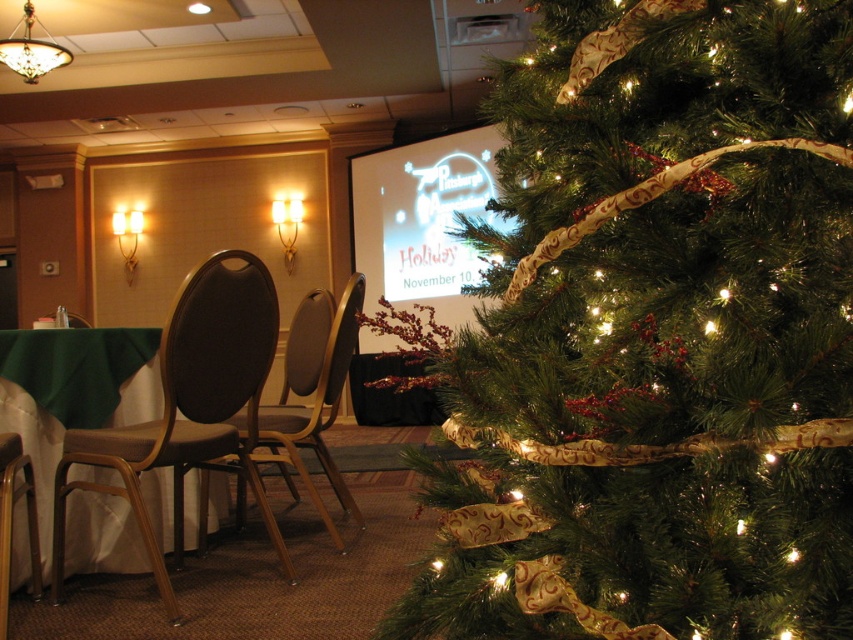
Question: Does brown fabric chair at left appear under green fabric tablecloth at lower left?

Choices:
 (A) no
 (B) yes

Answer: (A)

Question: Which point is closer to the camera?

Choices:
 (A) matte brown chair at left
 (B) brown wood chair at left
 (C) green fabric tablecloth at lower left
 (D) brown fabric chair at left

Answer: (B)

Question: Can you confirm if brown fabric chair at left is positioned to the right of brown wood chair at left?

Choices:
 (A) no
 (B) yes

Answer: (B)

Question: Among these points, which one is farthest from the camera?

Choices:
 (A) (339, 336)
 (B) (6, 476)

Answer: (A)

Question: Does brown fabric chair at left appear over matte brown chair at left?

Choices:
 (A) yes
 (B) no

Answer: (A)

Question: Which object appears farthest from the camera in this image?

Choices:
 (A) brown wood chair at left
 (B) brown fabric chair at left

Answer: (B)